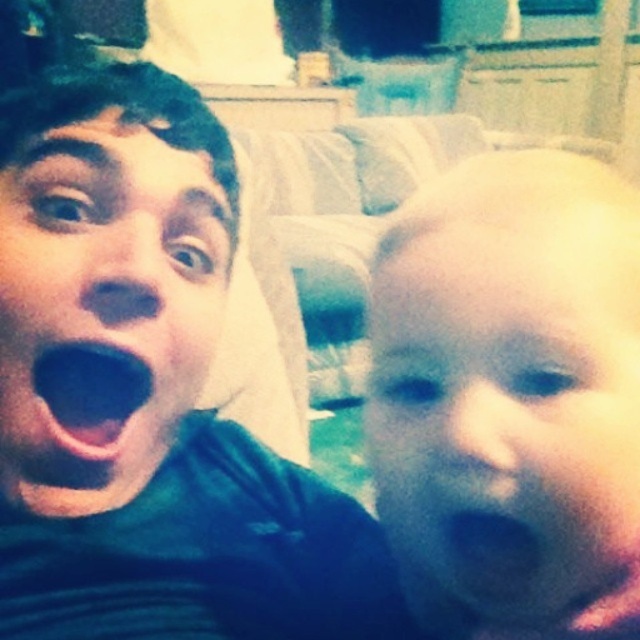
You are a photographer adjusting the focus on a portrait. The subject has a green matte face at left and a black matte mouth at left. If your camera can only focus on one object at a time, which should you choose to ensure the mouth is sharp?

The black matte mouth at left is closer to the camera than the green matte face at left, so focusing on the black matte mouth at left will ensure it appears sharp.

Looking at this image, you are taking a selfie with two friends. You notice two points in the photo labeled as point 1 at coordinates point (412, 198) and point 2 at coordinates point (86, 413). If you want to focus on the closer point to you, which point should you choose?

Point (412, 198) is further to the viewer than point (86, 413), so the closer point to you is point (86, 413). Therefore, you should choose point (86, 413) to focus on.

You are a photographer trying to adjust the focus of your camera to capture both the smooth skin baby at right and the green matte face at left clearly. Based on their positions, which one should you focus on first to ensure it appears sharp?

The smooth skin baby at right is in front of the green matte face at left, so focusing on the smooth skin baby at right first will ensure it appears sharp. Since the green matte face at left is behind, adjusting focus to it might require refocusing.